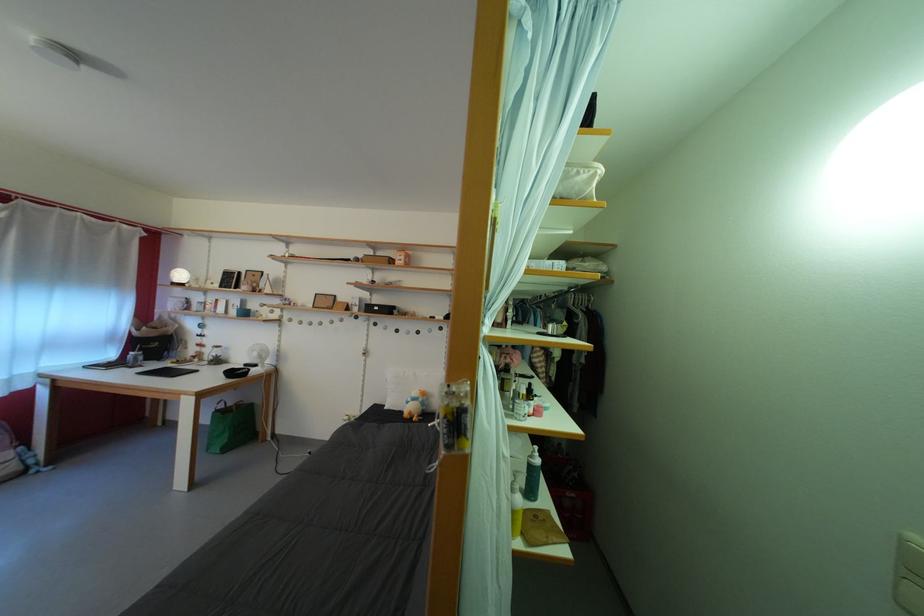
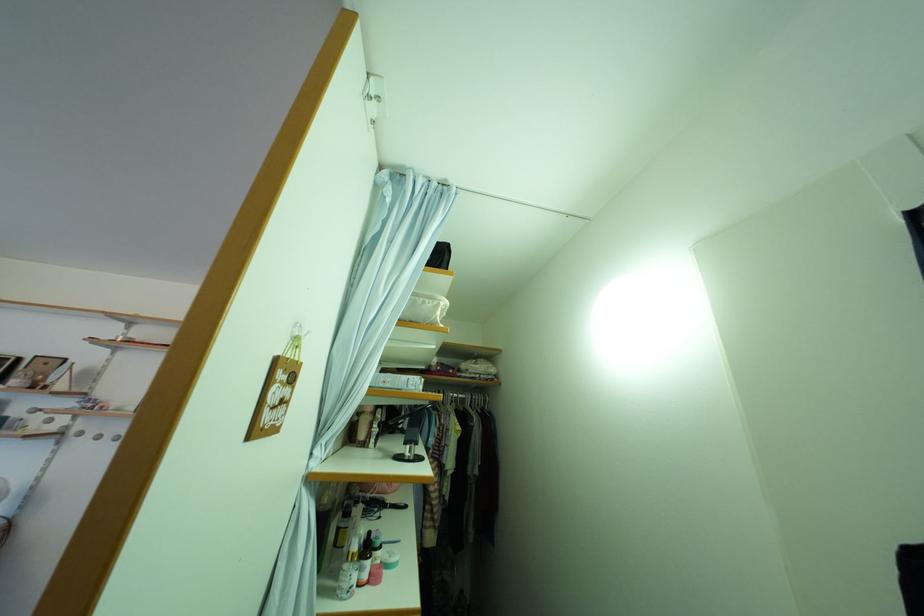
Find the pixel in the second image that matches (x=560, y=331) in the first image.

(417, 454)